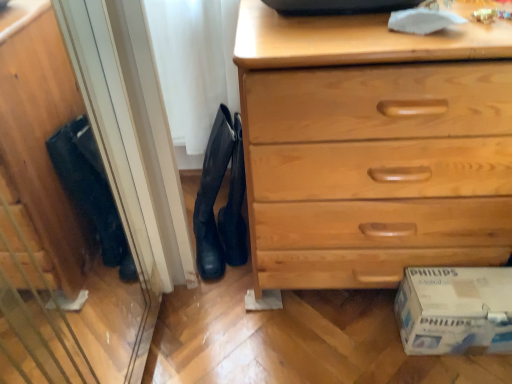
Question: Does black suede boot at center have a lesser width compared to black leather boots at center?

Choices:
 (A) no
 (B) yes

Answer: (A)

Question: Is black suede boot at center positioned with its back to black leather boots at center?

Choices:
 (A) yes
 (B) no

Answer: (A)

Question: Is black leather boots at center located within black suede boot at center?

Choices:
 (A) yes
 (B) no

Answer: (A)

Question: Does black suede boot at center appear on the right side of black leather boots at center?

Choices:
 (A) no
 (B) yes

Answer: (A)

Question: From the image's perspective, does black suede boot at center appear lower than black leather boots at center?

Choices:
 (A) yes
 (B) no

Answer: (A)

Question: From the image's perspective, relative to black leather boots at center, is white cardboard box at lower right above or below?

Choices:
 (A) below
 (B) above

Answer: (A)

Question: Considering their positions, is white cardboard box at lower right located in front of or behind black leather boots at center?

Choices:
 (A) behind
 (B) front

Answer: (B)

Question: Choose the correct answer: Is white cardboard box at lower right inside black leather boots at center or outside it?

Choices:
 (A) inside
 (B) outside

Answer: (B)

Question: Is white cardboard box at lower right bigger or smaller than black leather boots at center?

Choices:
 (A) small
 (B) big

Answer: (A)

Question: From a real-world perspective, relative to black leather boots at center, is black suede boot at center vertically above or below?

Choices:
 (A) below
 (B) above

Answer: (A)

Question: From the image's perspective, is black suede boot at center located above or below black leather boots at center?

Choices:
 (A) below
 (B) above

Answer: (A)

Question: Is black suede boot at center inside the boundaries of black leather boots at center, or outside?

Choices:
 (A) outside
 (B) inside

Answer: (B)

Question: Is point (219, 150) closer or farther from the camera than point (239, 145)?

Choices:
 (A) farther
 (B) closer

Answer: (A)

Question: Does point (335, 248) appear closer or farther from the camera than point (452, 283)?

Choices:
 (A) farther
 (B) closer

Answer: (A)

Question: From a real-world perspective, is light wood chest of drawers at lower right positioned above or below white cardboard box at lower right?

Choices:
 (A) below
 (B) above

Answer: (B)